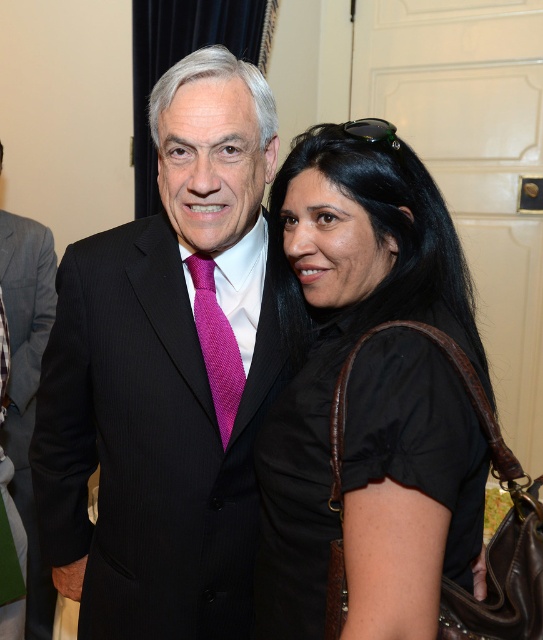
You are a photographer at a formal event. You need to adjust your camera to focus on the black pinstripe suit at center and the pink textured tie at center. Which object should you focus on first if you want to start from the lower part of the image?

The black pinstripe suit at center is located below the pink textured tie at center, so you should focus on the black pinstripe suit at center first to start from the lower part of the image.

You are a photographer setting up a photo shoot for two models wearing the black pinstripe suit at center and the gray wool suit at left. The camera is positioned at eye level with the shorter model. Which model should stand where to ensure both appear to be of equal height in the photo?

The black pinstripe suit at center is shorter than the gray wool suit at left, so the model in the black pinstripe suit at center should stand slightly closer to the camera and the model in the gray wool suit at left should stand further back. This positioning will make them appear more balanced in height in the photo.

You are taking a photo of two people at an event. You notice two points in the image at coordinates point (54,346) and point (203,355). Which point is closer to the camera?

Point (203,355) is closer to the camera than point (54,346) because the latter is further away according to their coordinates.